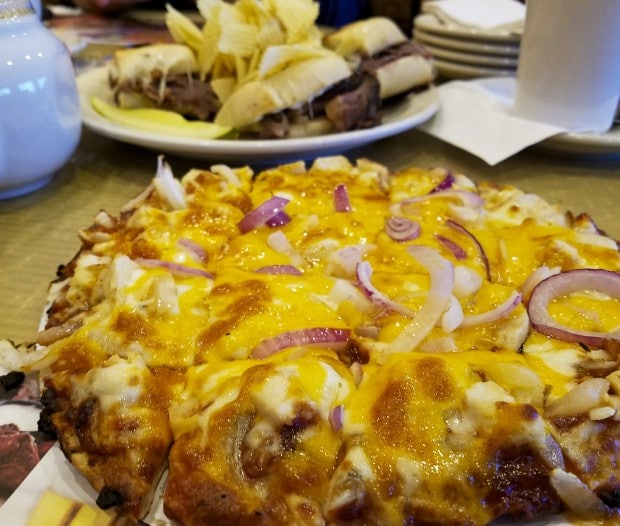
You are a GUI agent. You are given a task and a screenshot of the screen. Output one action in this format:
    pyautogui.click(x=<x>, y=<y>)
    Task: Click on the table mat
    This screenshot has height=526, width=620.
    Given the screenshot: What is the action you would take?
    pyautogui.click(x=43, y=236), pyautogui.click(x=577, y=187)